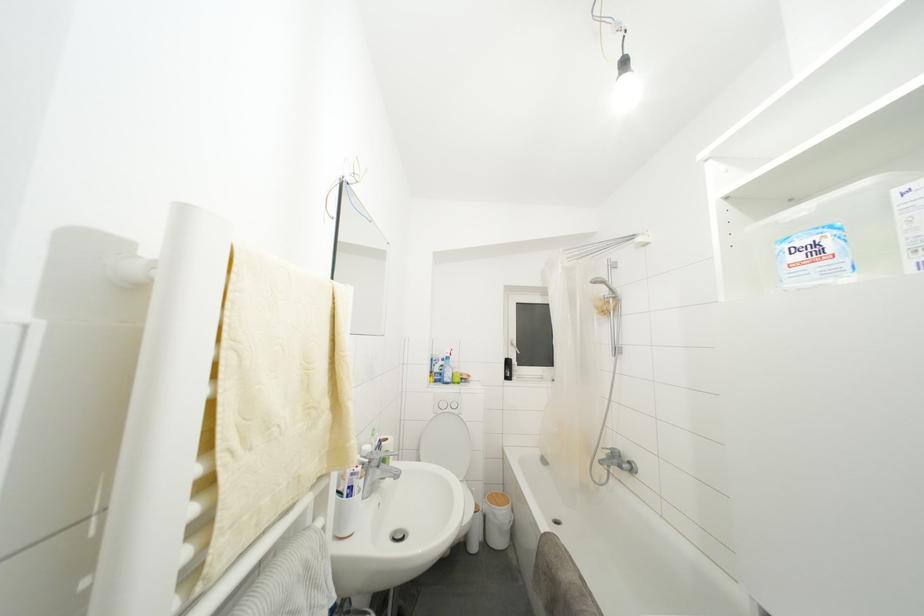
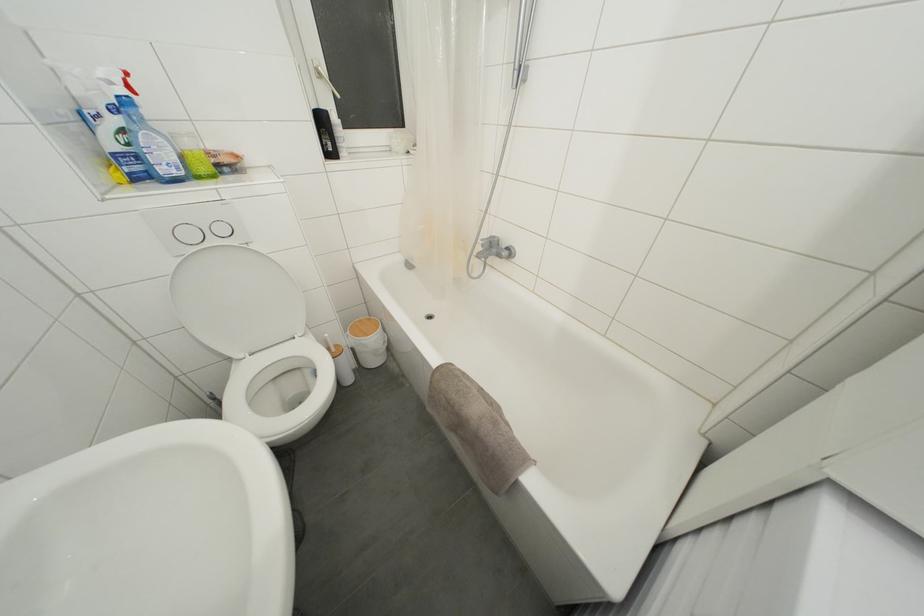
Find the pixel in the second image that matches (513,368) in the first image.

(325, 126)